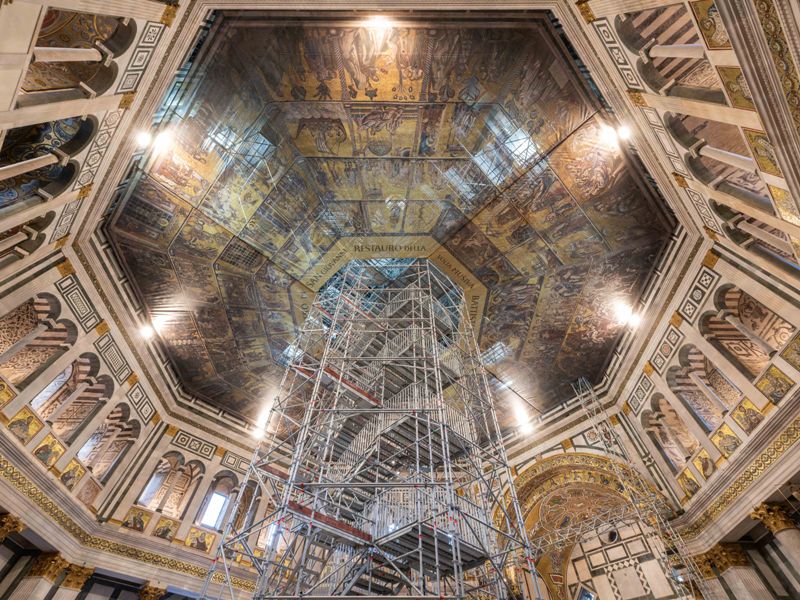
Find the location of a particular element. wall is located at coordinates (693, 389), (34, 390), (48, 95), (121, 584), (752, 562).